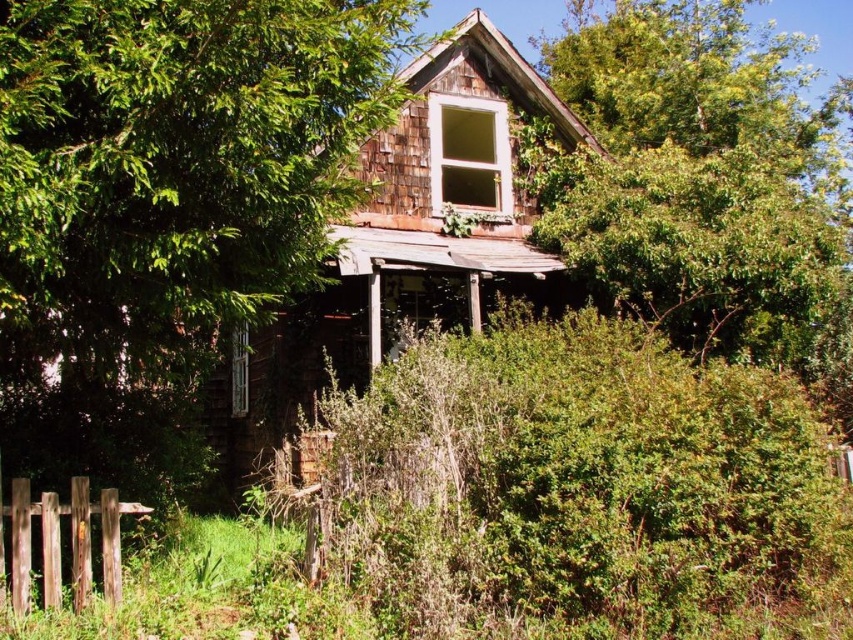
Can you confirm if green leafy bush at center is positioned to the right of green leafy tree at upper left?

Indeed, green leafy bush at center is positioned on the right side of green leafy tree at upper left.

Which is behind, point (830, 464) or point (299, 211)?

The point (830, 464) is behind.

Identify the location of green leafy bush at center. (582, 490).

Who is more distant from viewer, (190, 38) or (245, 339)?

The point (245, 339) is behind.

Between point (339, 170) and point (239, 397), which one is positioned behind?

The point (239, 397) is more distant.

This screenshot has width=853, height=640. Find the location of `green leafy tree at upper left`. green leafy tree at upper left is located at coordinates (166, 202).

Which is more to the left, green leafy bush at center or white wood window at upper center?

From the viewer's perspective, white wood window at upper center appears more on the left side.

What do you see at coordinates (582, 490) in the screenshot? This screenshot has height=640, width=853. I see `green leafy bush at center` at bounding box center [582, 490].

In order to click on green leafy bush at center in this screenshot , I will do `click(582, 490)`.